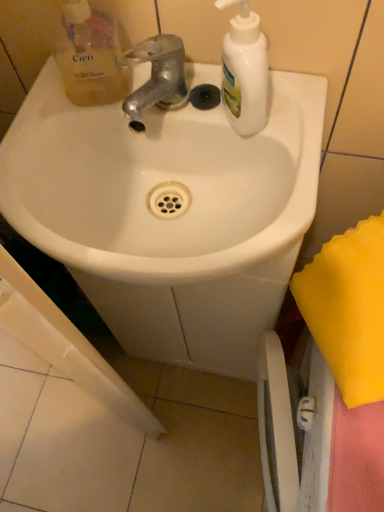
Question: From the image's perspective, is shiny metallic faucet at center below translucent yellow liquid soap at upper left?

Choices:
 (A) no
 (B) yes

Answer: (B)

Question: Is shiny metallic faucet at center next to translucent yellow liquid soap at upper left and touching it?

Choices:
 (A) yes
 (B) no

Answer: (A)

Question: Does shiny metallic faucet at center lie behind translucent yellow liquid soap at upper left?

Choices:
 (A) no
 (B) yes

Answer: (B)

Question: From the image's perspective, would you say shiny metallic faucet at center is positioned over translucent yellow liquid soap at upper left?

Choices:
 (A) no
 (B) yes

Answer: (A)

Question: Does shiny metallic faucet at center have a larger size compared to translucent yellow liquid soap at upper left?

Choices:
 (A) no
 (B) yes

Answer: (A)

Question: Which is correct: translucent yellow liquid soap at upper left is inside white glossy sink at center, or outside of it?

Choices:
 (A) inside
 (B) outside

Answer: (B)

Question: Is point (81, 98) positioned closer to the camera than point (66, 114)?

Choices:
 (A) closer
 (B) farther

Answer: (A)

Question: From a real-world perspective, is translucent yellow liquid soap at upper left above or below white glossy sink at center?

Choices:
 (A) below
 (B) above

Answer: (B)

Question: From the image's perspective, is translucent yellow liquid soap at upper left positioned above or below white glossy sink at center?

Choices:
 (A) above
 (B) below

Answer: (A)

Question: From a real-world perspective, is translucent yellow liquid soap at upper left physically located above or below shiny metallic faucet at center?

Choices:
 (A) above
 (B) below

Answer: (A)

Question: Is point (77, 74) positioned closer to the camera than point (160, 52)?

Choices:
 (A) closer
 (B) farther

Answer: (B)

Question: From their relative heights in the image, would you say translucent yellow liquid soap at upper left is taller or shorter than shiny metallic faucet at center?

Choices:
 (A) short
 (B) tall

Answer: (B)

Question: Looking at their shapes, would you say translucent yellow liquid soap at upper left is wider or thinner than shiny metallic faucet at center?

Choices:
 (A) wide
 (B) thin

Answer: (B)

Question: Considering the positions of white glossy sink at center and white matte bottle at upper right in the image, is white glossy sink at center wider or thinner than white matte bottle at upper right?

Choices:
 (A) thin
 (B) wide

Answer: (B)

Question: From a real-world perspective, is white glossy sink at center above or below white matte bottle at upper right?

Choices:
 (A) below
 (B) above

Answer: (A)